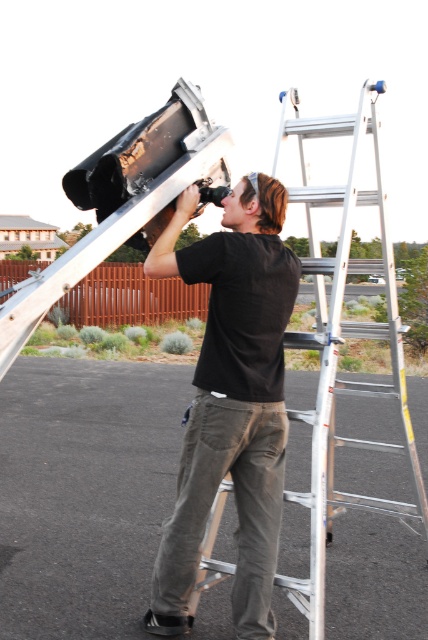
Can you confirm if black matte shirt at center is positioned to the left of silver metallic ladder at center?

Indeed, black matte shirt at center is positioned on the left side of silver metallic ladder at center.

Who is more distant from viewer, (270, 589) or (416, 500)?

Positioned behind is point (416, 500).

What do you see at coordinates (231, 401) in the screenshot? I see `black matte shirt at center` at bounding box center [231, 401].

The width and height of the screenshot is (428, 640). What are the coordinates of `black matte shirt at center` in the screenshot? It's located at (231, 401).